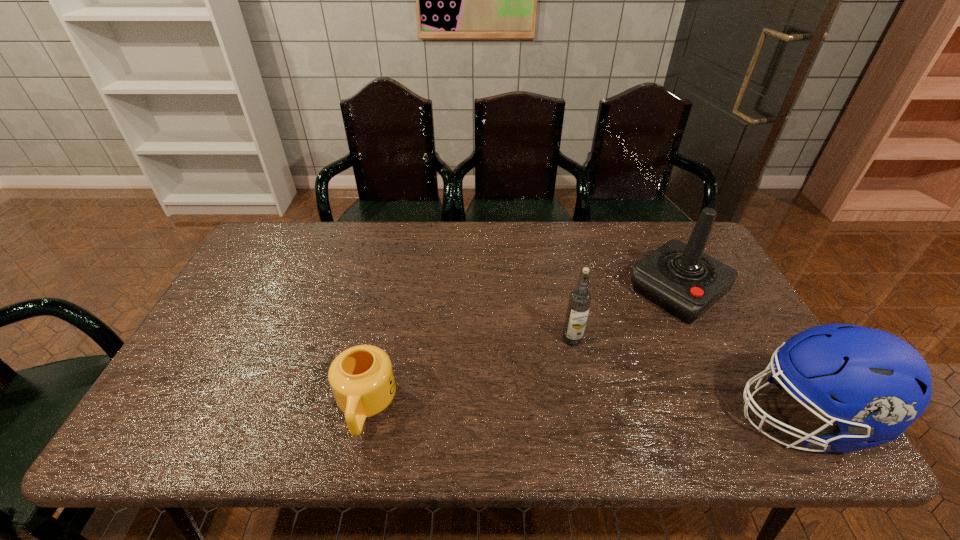
Where is `the shortest object`? The height and width of the screenshot is (540, 960). the shortest object is located at coordinates (362, 380).

Locate an element on the screen. This screenshot has height=540, width=960. the leftmost object is located at coordinates (362, 380).

Find the location of `football helmet`. football helmet is located at coordinates (882, 384).

Locate an element on the screen. joystick is located at coordinates [681, 279].

Locate an element on the screen. This screenshot has height=540, width=960. the third object from right to left is located at coordinates (579, 302).

Locate an element on the screen. The height and width of the screenshot is (540, 960). vodka is located at coordinates (579, 302).

Identify the location of free space located 0.180m on the front-facing side of the joystick. (610, 347).

The image size is (960, 540). Find the location of `vacant space located 0.050m on the front-facing side of the joystick`. vacant space located 0.050m on the front-facing side of the joystick is located at coordinates (638, 323).

Locate an element on the screen. This screenshot has width=960, height=540. free region located on the front-facing side of the joystick is located at coordinates pyautogui.click(x=614, y=343).

Identify the location of vacant space located on the label of the second farthest object. (542, 379).